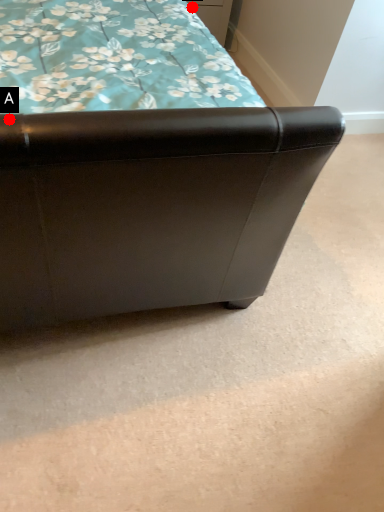
Question: Two points are circled on the image, labeled by A and B beside each circle. Which of the following is the closest to the observer?

Choices:
 (A) A is closer
 (B) B is closer

Answer: (A)